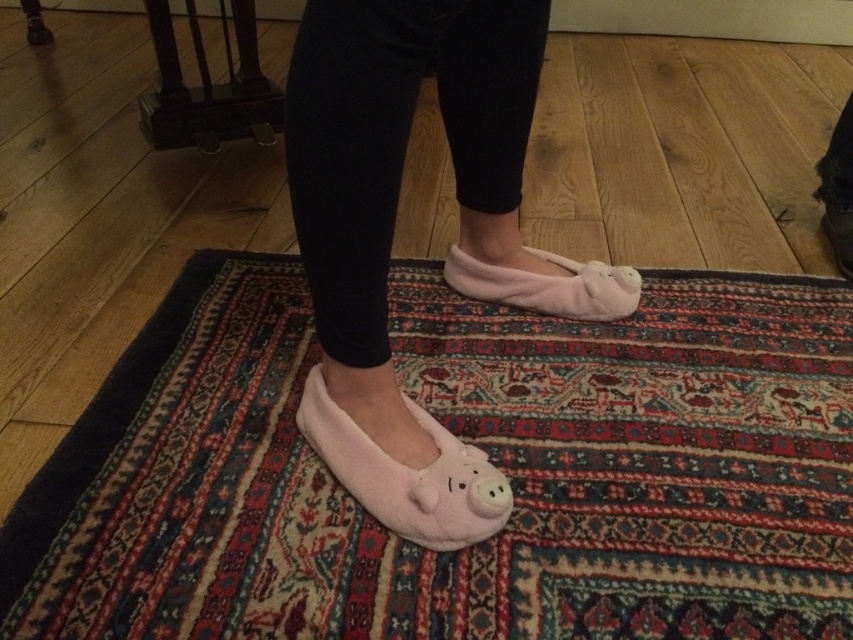
Question: Is pink fuzzy slippers at center below pink fuzzy slipper at lower center?

Choices:
 (A) no
 (B) yes

Answer: (B)

Question: Which object appears closest to the camera in this image?

Choices:
 (A) fluffy pink slipper at lower center
 (B) pink fuzzy slippers at center
 (C) fluffy pink slippers at center
 (D) pink fuzzy slipper at lower center

Answer: (B)

Question: Which point appears closest to the camera in this image?

Choices:
 (A) (389, 486)
 (B) (849, 212)

Answer: (A)

Question: In this image, where is pink fuzzy slippers at center located relative to fluffy pink slippers at center?

Choices:
 (A) below
 (B) above

Answer: (B)

Question: Observing the image, what is the correct spatial positioning of pink fuzzy slippers at center in reference to fluffy pink slippers at center?

Choices:
 (A) above
 (B) below

Answer: (A)

Question: Which of the following is the farthest from the observer?

Choices:
 (A) pink fuzzy slipper at lower center
 (B) pink fuzzy slippers at center
 (C) fluffy pink slipper at lower center
 (D) fluffy pink slippers at center

Answer: (A)